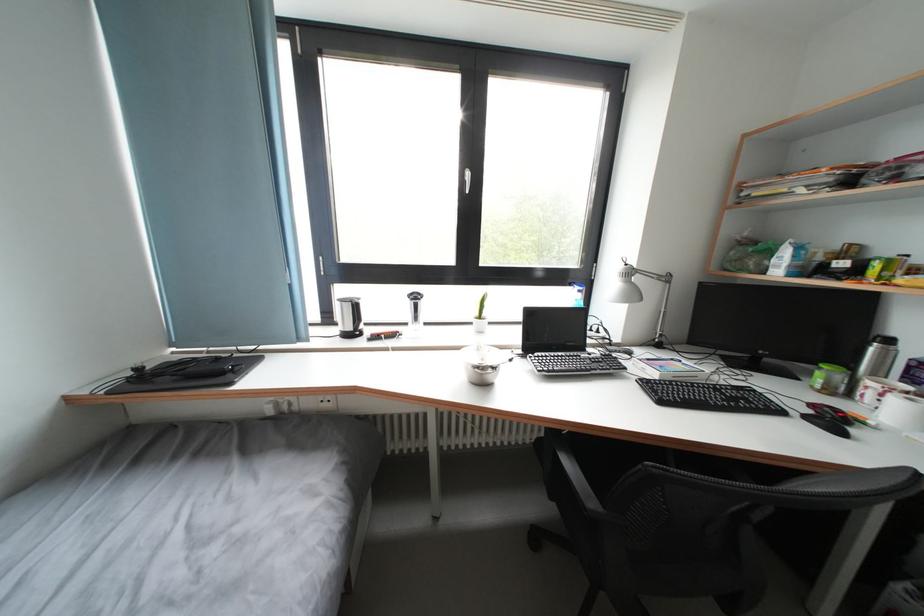
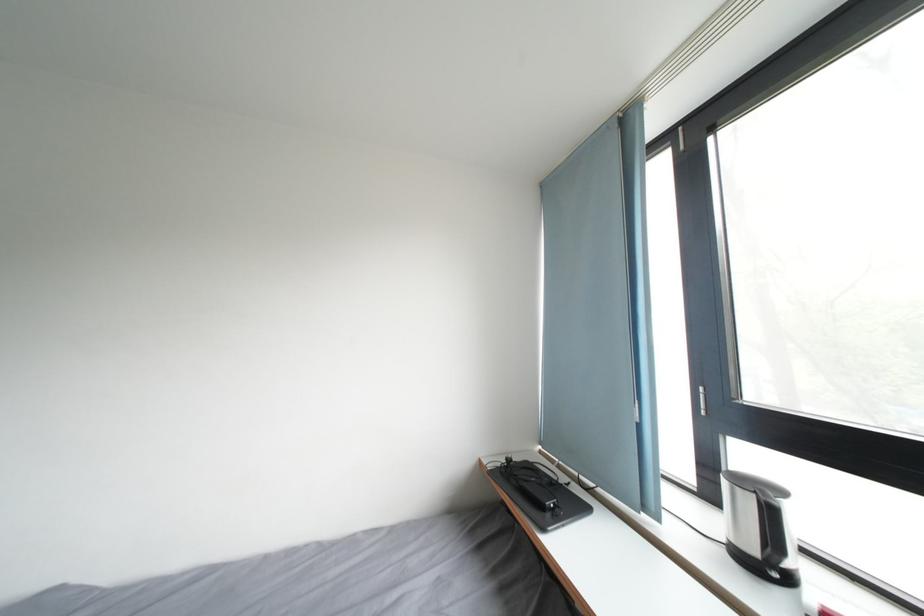
Find the pixel in the second image that matches point (306, 344) in the first image.

(651, 514)